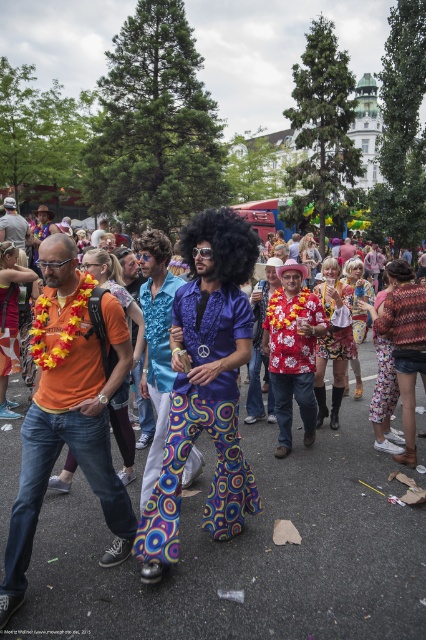
Is point (299, 465) more distant than point (189, 426)?

Yes.

Can you confirm if vibrant printed pants at center is shorter than vibrant polyester afro wig at center?

Correct, vibrant printed pants at center is not as tall as vibrant polyester afro wig at center.

Where is `vibrant printed pants at center`? vibrant printed pants at center is located at coordinates (247, 554).

The height and width of the screenshot is (640, 426). In order to click on vibrant printed pants at center in this screenshot , I will do point(247,554).

The height and width of the screenshot is (640, 426). In order to click on vibrant polyester afro wig at center in this screenshot , I will do `click(204, 387)`.

Is point (189, 289) positioned in front of point (141, 236)?

Yes, point (189, 289) is closer to viewer.

What do you see at coordinates (204, 387) in the screenshot? I see `vibrant polyester afro wig at center` at bounding box center [204, 387].

At what (x,y) coordinates should I click in order to perform the action: click on vibrant polyester afro wig at center. Please return your answer as a coordinate pair (x, y). The height and width of the screenshot is (640, 426). Looking at the image, I should click on (204, 387).

Who is shorter, orange fabric shirt at left or vivid multicolored pants at center?

orange fabric shirt at left is shorter.

Does orange fabric shirt at left have a lesser height compared to vivid multicolored pants at center?

Yes.

At what (x,y) coordinates should I click in order to perform the action: click on orange fabric shirt at left. Please return your answer as a coordinate pair (x, y). The height and width of the screenshot is (640, 426). Looking at the image, I should click on (68, 412).